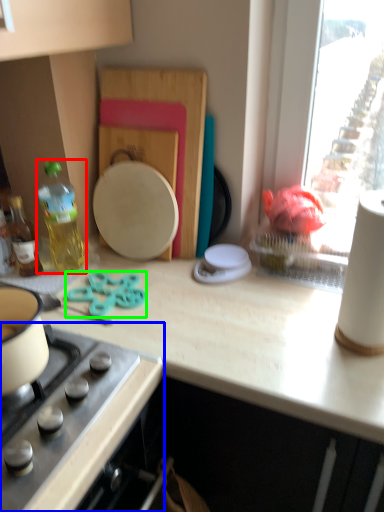
Question: Based on their relative distances, which object is farther from bottle (highlighted by a red box)? Choose from gas stove (highlighted by a blue box) and scissors (highlighted by a green box).

Choices:
 (A) gas stove
 (B) scissors

Answer: (A)